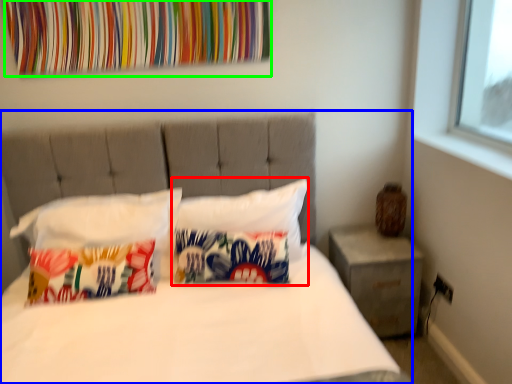
Question: Which object is positioned closest to pillow (highlighted by a red box)? Select from bed (highlighted by a blue box) and tapestry (highlighted by a green box).

Choices:
 (A) bed
 (B) tapestry

Answer: (A)